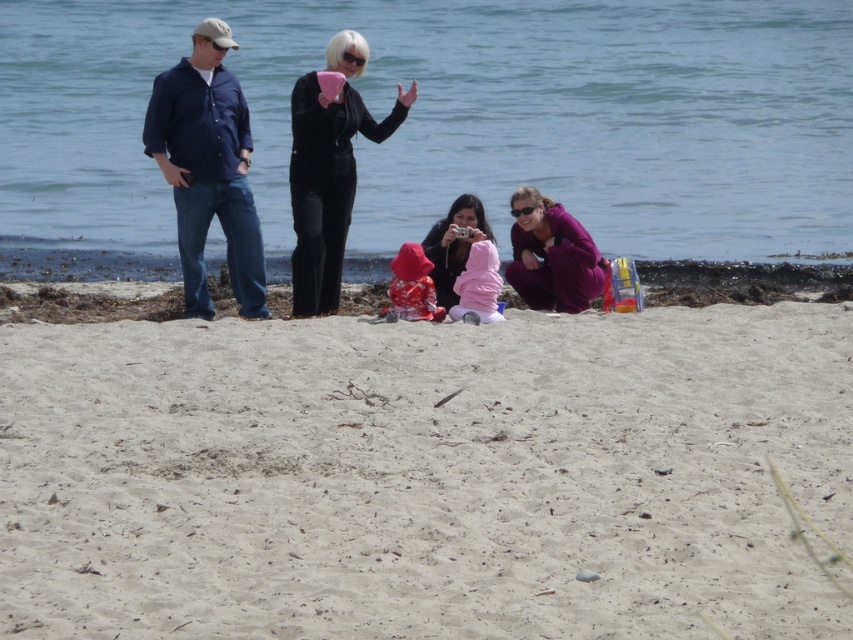
Question: Does purple matte jacket at lower center lie in front of floral fabric baby at center?

Choices:
 (A) no
 (B) yes

Answer: (A)

Question: Is blue water at upper center in front of purple matte jacket at lower center?

Choices:
 (A) no
 (B) yes

Answer: (A)

Question: Can you confirm if matte black clothing at center is thinner than floral fabric baby at center?

Choices:
 (A) no
 (B) yes

Answer: (A)

Question: Which point is closer to the camera?

Choices:
 (A) matte black outfit at center
 (B) blue water at upper center
 (C) pink fleece jacket at center

Answer: (C)

Question: Among these points, which one is farthest from the camera?

Choices:
 (A) (550, 216)
 (B) (813, 321)
 (C) (167, 120)
 (D) (186, 253)

Answer: (A)

Question: Which object is positioned farthest from the purple matte jacket at lower center?

Choices:
 (A) denim shirt at left
 (B) pink fleece jacket at center

Answer: (A)